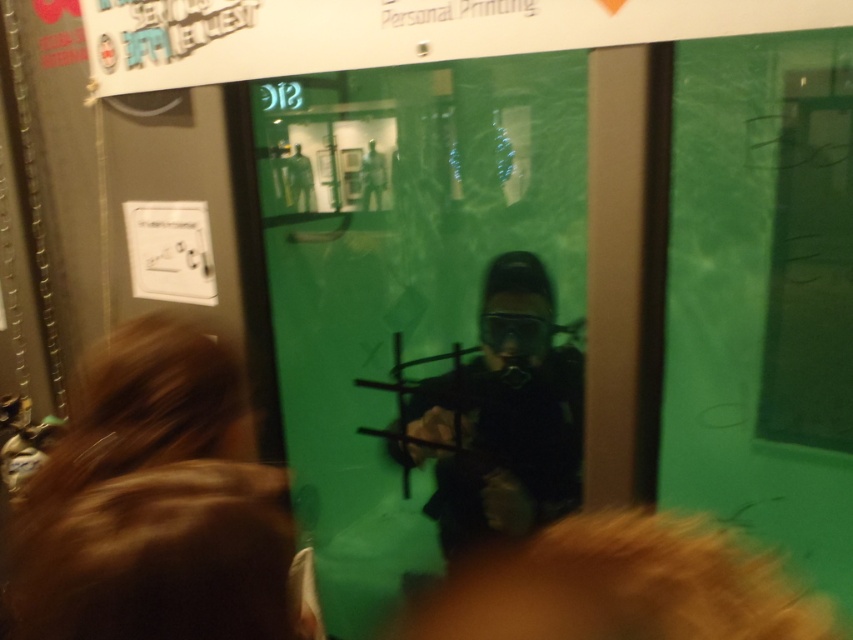
Question: Observing the image, what is the correct spatial positioning of green matte glass door at center in reference to black matte diving suit at center?

Choices:
 (A) right
 (B) left

Answer: (B)

Question: Which of the following is the closest to the observer?

Choices:
 (A) green matte glass door at center
 (B) black matte diving suit at center

Answer: (A)

Question: Can you confirm if green matte glass door at center is thinner than black matte diving suit at center?

Choices:
 (A) yes
 (B) no

Answer: (B)

Question: Is green matte glass door at center positioned in front of black matte diving suit at center?

Choices:
 (A) yes
 (B) no

Answer: (A)

Question: Which point is closer to the camera taking this photo?

Choices:
 (A) click(x=792, y=253)
 (B) click(x=550, y=490)

Answer: (A)